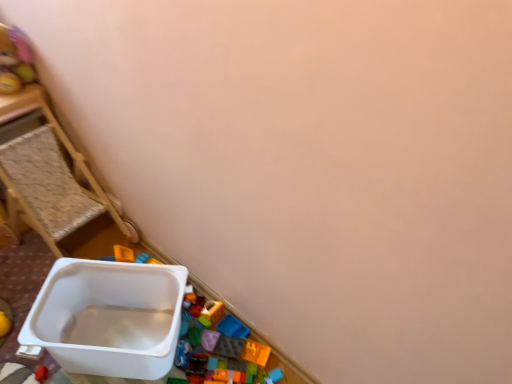
Question: Visually, is white plastic container at left positioned to the left or to the right of soft plush bear at upper left?

Choices:
 (A) right
 (B) left

Answer: (A)

Question: In the image, is white plastic container at left positioned in front of or behind soft plush bear at upper left?

Choices:
 (A) behind
 (B) front

Answer: (B)

Question: From the image's perspective, is white plastic container at left above or below soft plush bear at upper left?

Choices:
 (A) above
 (B) below

Answer: (B)

Question: Considering the positions of soft plush bear at upper left and white plastic container at left in the image, is soft plush bear at upper left wider or thinner than white plastic container at left?

Choices:
 (A) thin
 (B) wide

Answer: (A)

Question: Considering the positions of soft plush bear at upper left and white plastic container at left in the image, is soft plush bear at upper left bigger or smaller than white plastic container at left?

Choices:
 (A) big
 (B) small

Answer: (B)

Question: From the image's perspective, is soft plush bear at upper left located above or below white plastic container at left?

Choices:
 (A) above
 (B) below

Answer: (A)

Question: From a real-world perspective, is soft plush bear at upper left positioned above or below white plastic container at left?

Choices:
 (A) above
 (B) below

Answer: (A)